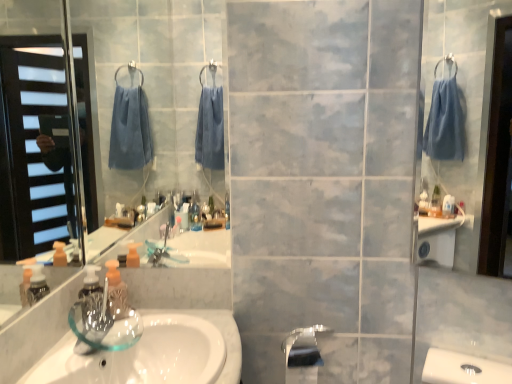
This screenshot has width=512, height=384. In order to click on vacant area that is in front of transparent glass soap dispenser at lower left in this screenshot , I will do `click(92, 348)`.